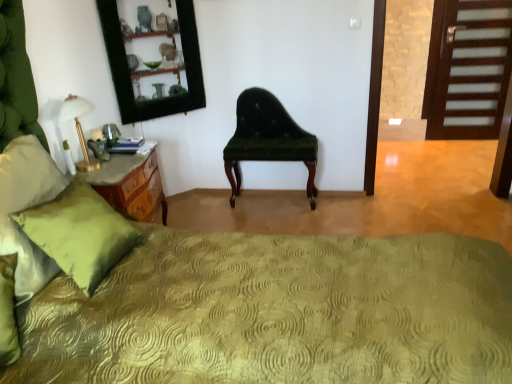
Locate an element on the screen. The image size is (512, 384). empty space that is ontop of green polished wood nightstand at left (from a real-world perspective) is located at coordinates (119, 159).